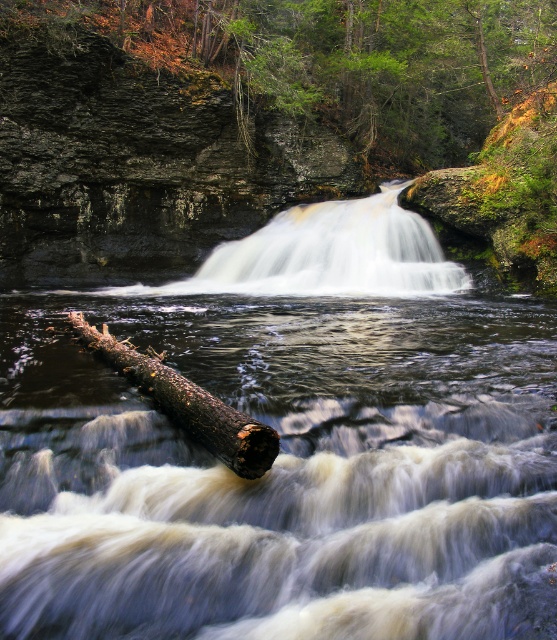
You are standing at the edge of the pool below the waterfall. You want to cross to the other side. The dark brown rough log at lower center and the green mossy rock at upper center are in your path. Which object should you avoid stepping on to cross safely?

You should avoid stepping on the dark brown rough log at lower center because it is behind the green mossy rock at upper center and might be submerged or slippery in the turbulent water.

You are standing at the edge of the waterfall and want to take a photo. There are two points marked in the scene, point A at coordinates point (378, 131) and point B at coordinates point (218, 406). Which point is closer to your camera?

Point A at coordinates point (378, 131) is closer to the camera than point B at coordinates point (218, 406) because it is further to the camera than the other point.

You are a hiker standing at the edge of the pool below the waterfall. You notice the green mossy rock at upper center and the white frothy water at center. Which object is higher in elevation compared to the other?

The green mossy rock at upper center is much taller than the white frothy water at center, so it is higher in elevation.